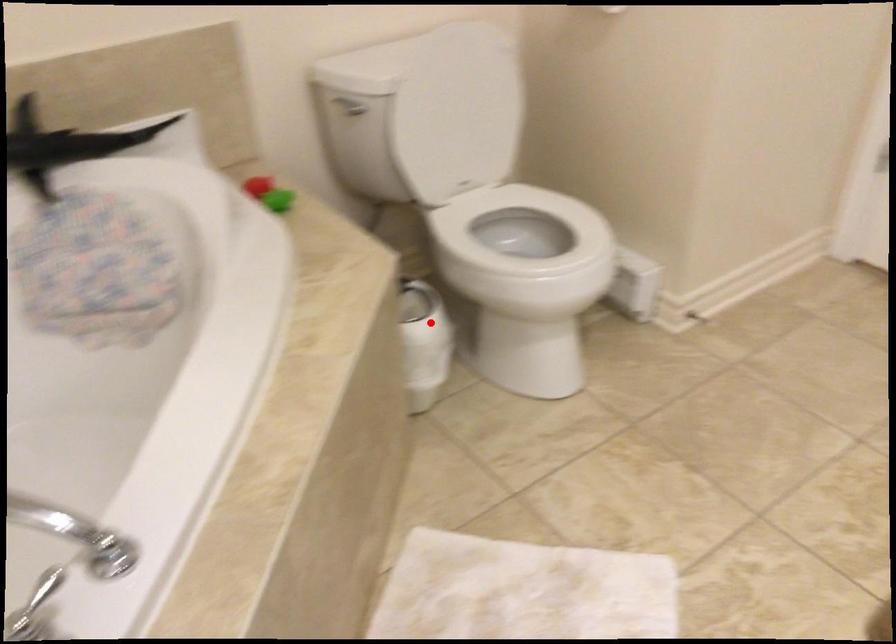
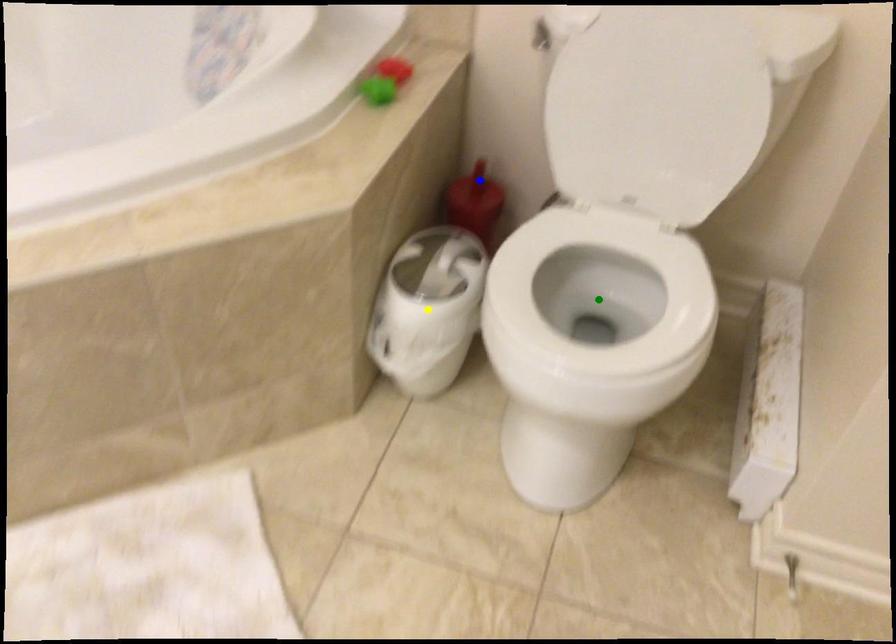
Question: I am providing you with two images of the same scene from different viewpoints. A red point is marked on the first image. You are given multiple points on the second image. Which point in image 2 is actually the same real-world point as the red point in image 1?

Choices:
 (A) blue point
 (B) green point
 (C) yellow point

Answer: (C)